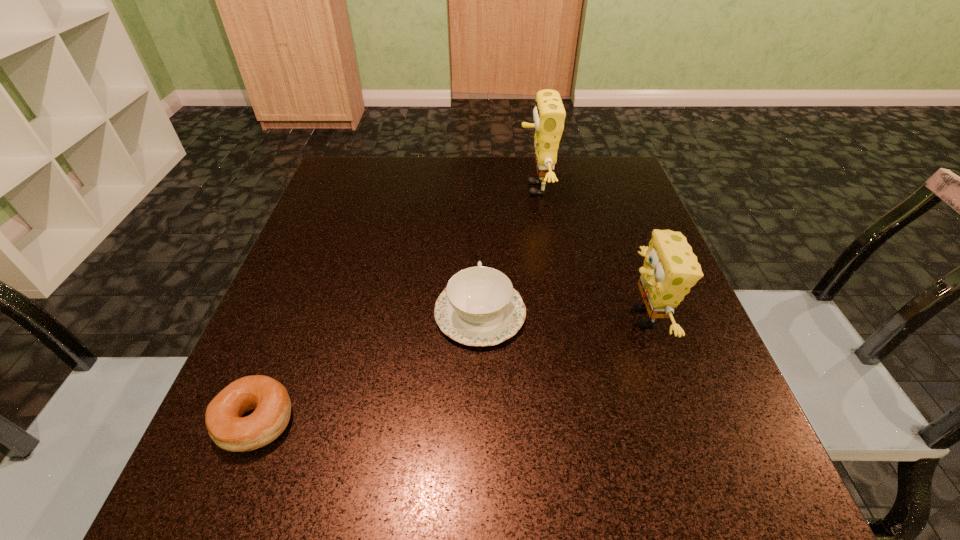
Image resolution: width=960 pixels, height=540 pixels. I want to click on object that is positioned at the left edge, so [x=269, y=399].

Where is `object positioned at the right edge`? This screenshot has width=960, height=540. object positioned at the right edge is located at coordinates (670, 269).

Where is `object that is at the near left corner`? The image size is (960, 540). object that is at the near left corner is located at coordinates (269, 399).

Find the location of a particular element. vacant space at the far edge of the desktop is located at coordinates (450, 177).

In the image, there is a desktop. Where is `vacant area at the near edge`? vacant area at the near edge is located at coordinates (644, 508).

The width and height of the screenshot is (960, 540). I want to click on free space at the left edge of the desktop, so click(349, 226).

Image resolution: width=960 pixels, height=540 pixels. In the image, there is a desktop. In order to click on free space at the right edge in this screenshot , I will do `click(689, 405)`.

At what (x,y) coordinates should I click in order to perform the action: click on free region at the far left corner of the desktop. Please return your answer as a coordinate pair (x, y). Looking at the image, I should click on (373, 165).

This screenshot has height=540, width=960. Identify the location of vacant space at the near left corner of the desktop. (290, 513).

Where is `free space at the far right corner of the desktop`? This screenshot has height=540, width=960. free space at the far right corner of the desktop is located at coordinates (593, 180).